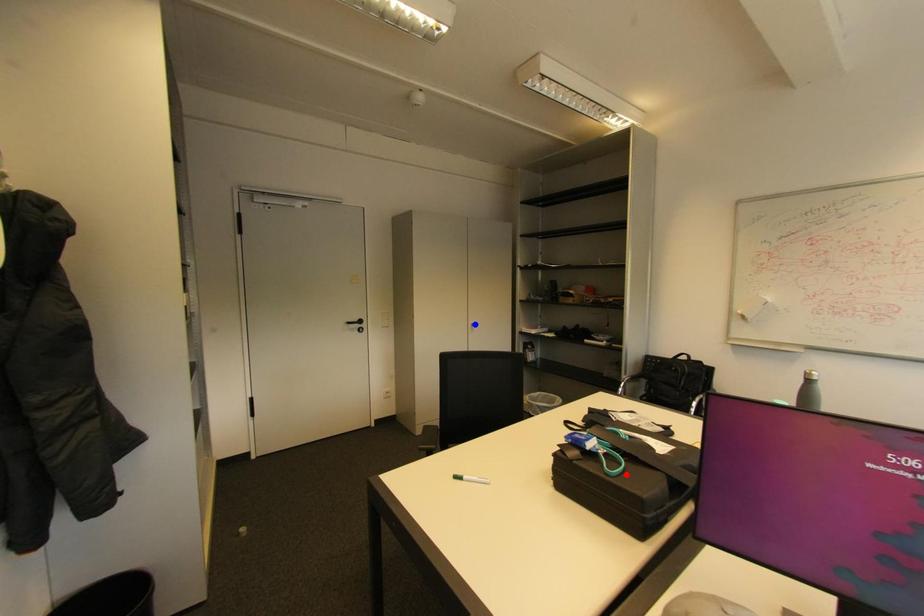
Question: In the image, two points are highlighted. Which point is nearer to the camera? Reply with the corresponding letter.

Choices:
 (A) blue point
 (B) red point

Answer: (B)